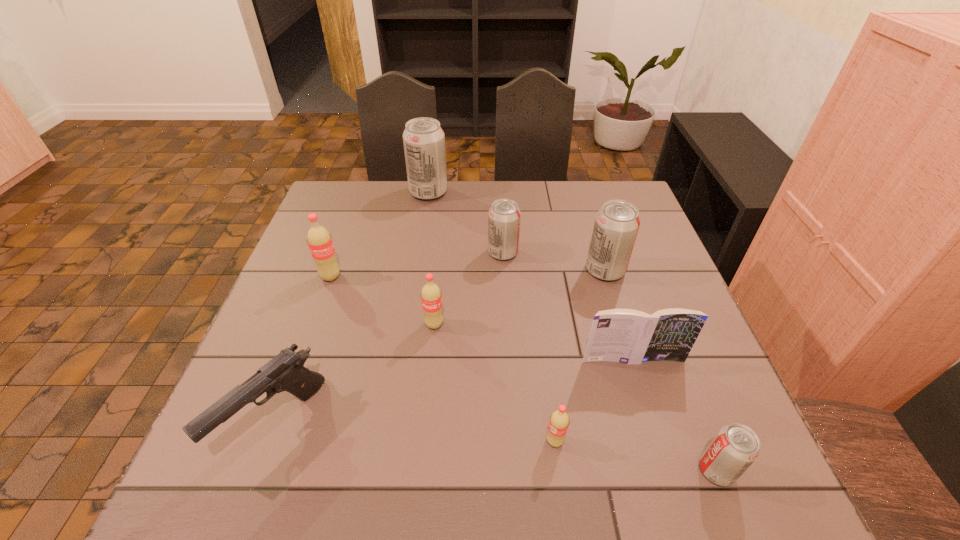
Locate which gray soda can is the second closest to the fourth object from right to left. Please provide its 2D coordinates. Your answer should be formatted as a tuple, i.e. [(x, y)], where the tuple contains the x and y coordinates of a point satisfying the conditions above.

[(616, 225)]

Find the location of a particular element. gray soda can that stands as the third closest to the smallest red soda is located at coordinates (504, 216).

Select which red soda appears as the closest to the fourth object from right to left. Please provide its 2D coordinates. Your answer should be formatted as a tuple, i.e. [(x, y)], where the tuple contains the x and y coordinates of a point satisfying the conditions above.

[(431, 297)]

Select which red soda is the second closest to the sixth soda can from left to right. Please provide its 2D coordinates. Your answer should be formatted as a tuple, i.e. [(x, y)], where the tuple contains the x and y coordinates of a point satisfying the conditions above.

[(559, 421)]

This screenshot has width=960, height=540. In order to click on free spot that satisfies the following two spatial constraints: 1. on the back side of the fifth object from left to right; 2. on the right side of the second smallest red soda in this screenshot , I will do click(x=442, y=253).

Where is `vacant space that satisfies the following two spatial constraints: 1. on the front side of the second farthest red soda; 2. on the right side of the fifth soda can from left to right`? This screenshot has height=540, width=960. vacant space that satisfies the following two spatial constraints: 1. on the front side of the second farthest red soda; 2. on the right side of the fifth soda can from left to right is located at coordinates (422, 441).

Where is `free location that satisfies the following two spatial constraints: 1. at the muzzle of the gun; 2. on the left side of the sixth farthest soda can`? The image size is (960, 540). free location that satisfies the following two spatial constraints: 1. at the muzzle of the gun; 2. on the left side of the sixth farthest soda can is located at coordinates (268, 441).

Where is `free space that satisfies the following two spatial constraints: 1. on the front side of the rightmost red soda; 2. on the left side of the second smallest gray soda can`? The width and height of the screenshot is (960, 540). free space that satisfies the following two spatial constraints: 1. on the front side of the rightmost red soda; 2. on the left side of the second smallest gray soda can is located at coordinates (514, 441).

You are a GUI agent. You are given a task and a screenshot of the screen. Output one action in this format:
    pyautogui.click(x=<x>, y=<y>)
    Task: Click on the vacant space that satisfies the following two spatial constraints: 1. on the front side of the fourth object from right to left; 2. on the right side of the leftmost soda can
    This screenshot has height=540, width=960.
    Given the screenshot: What is the action you would take?
    pyautogui.click(x=271, y=441)

Where is `blank space that satisfies the following two spatial constraints: 1. on the front side of the fourth soda can from right to left; 2. on the right side of the rightmost gray soda can`? The image size is (960, 540). blank space that satisfies the following two spatial constraints: 1. on the front side of the fourth soda can from right to left; 2. on the right side of the rightmost gray soda can is located at coordinates (516, 470).